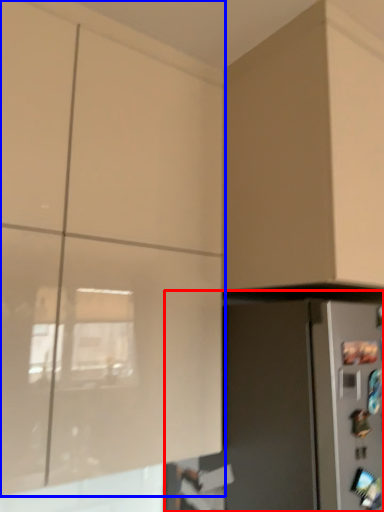
Question: Which of the following is the farthest to the observer, appliance (highlighted by a red box) or cabinetry (highlighted by a blue box)?

Choices:
 (A) appliance
 (B) cabinetry

Answer: (A)